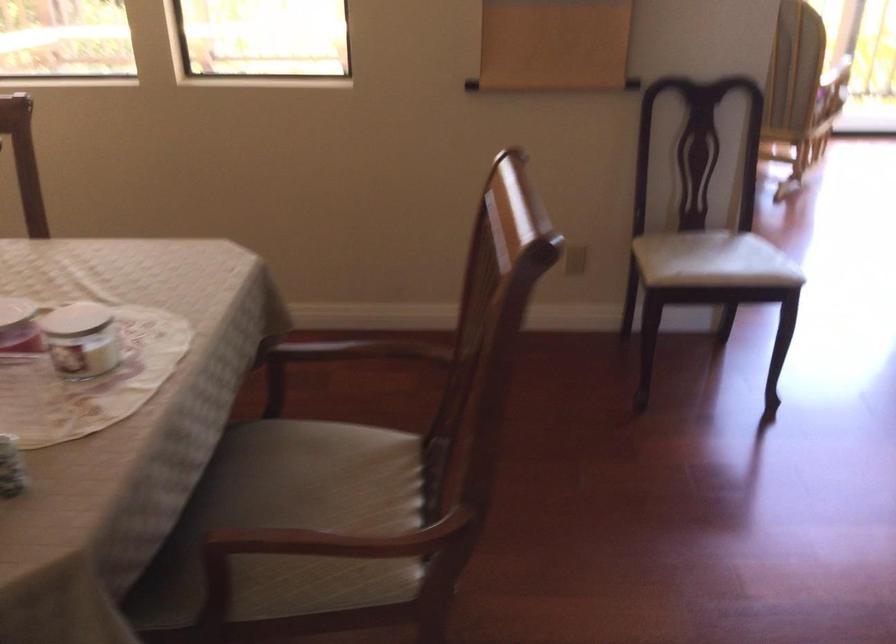
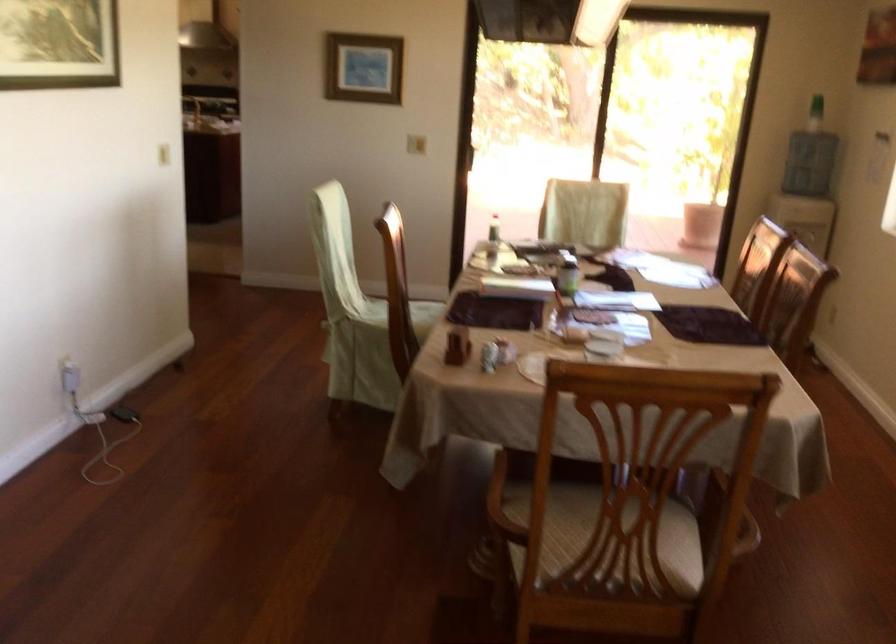
Find the pixel in the second image that matches point (470, 319) in the first image.

(722, 509)